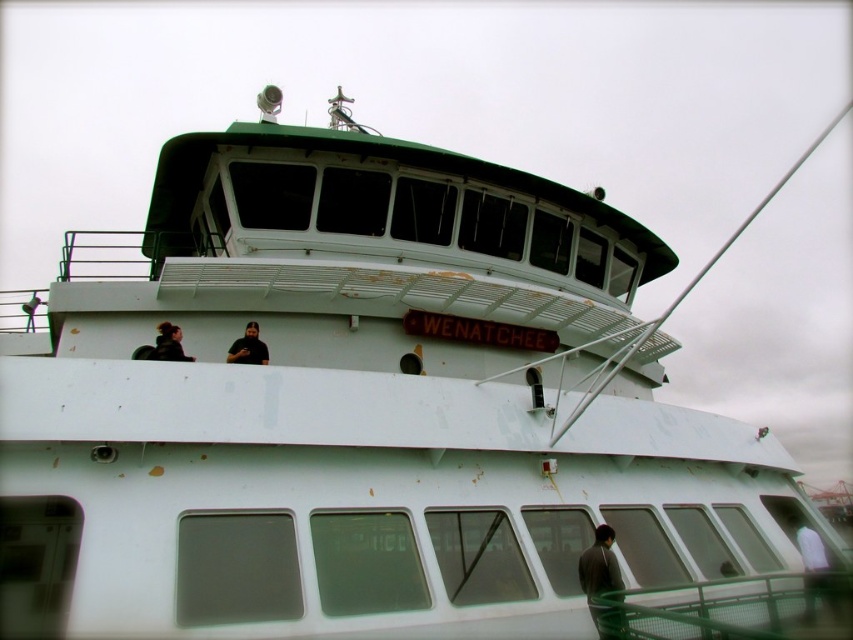
Question: Which point appears farthest from the camera in this image?

Choices:
 (A) (167, 333)
 (B) (606, 608)
 (C) (251, 358)

Answer: (C)

Question: Does dark gray sweater at lower right appear on the right side of black matte shirt at upper center?

Choices:
 (A) no
 (B) yes

Answer: (B)

Question: Among these objects, which one is farthest from the camera?

Choices:
 (A) matte black shirt at upper left
 (B) dark gray sweater at lower right
 (C) black matte shirt at upper center

Answer: (C)

Question: Where is black matte shirt at upper center located in relation to matte black shirt at upper left in the image?

Choices:
 (A) right
 (B) left

Answer: (A)

Question: Which of the following is the farthest from the observer?

Choices:
 (A) (264, 355)
 (B) (165, 353)
 (C) (602, 589)

Answer: (A)

Question: Is dark gray sweater at lower right in front of matte black shirt at upper left?

Choices:
 (A) yes
 (B) no

Answer: (A)